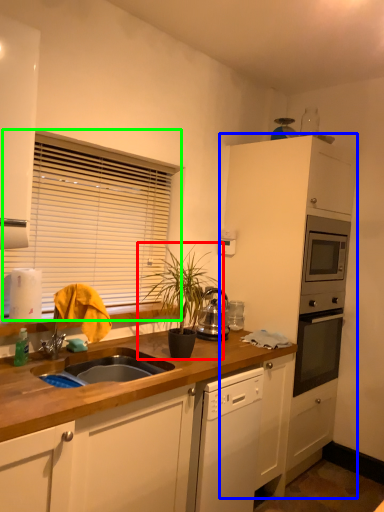
Question: Which object is the farthest from houseplant (highlighted by a red box)? Choose among these: cabinetry (highlighted by a blue box) or window blind (highlighted by a green box).

Choices:
 (A) cabinetry
 (B) window blind

Answer: (A)